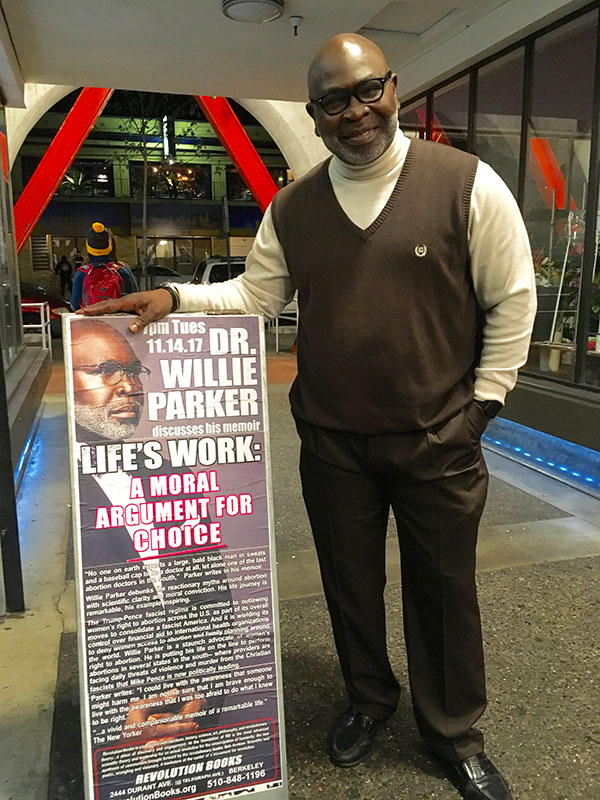
Where is `blue led lights`? The width and height of the screenshot is (600, 800). blue led lights is located at coordinates (27, 452), (551, 469).